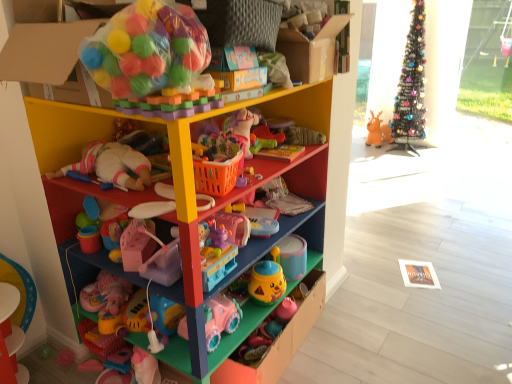
Question: Considering the positions of metallic wire christmas tree at upper right and pink plastic toy at center, the fourth toy from the top, in the image, is metallic wire christmas tree at upper right taller or shorter than pink plastic toy at center, the fourth toy from the top,?

Choices:
 (A) tall
 (B) short

Answer: (A)

Question: From the image's perspective, is metallic wire christmas tree at upper right above or below pink plastic toy at center, placed as the fourth toy when sorted from right to left?

Choices:
 (A) below
 (B) above

Answer: (B)

Question: Estimate the real-world distances between objects in this image. Which object is farther from the metallic wire christmas tree at upper right?

Choices:
 (A) rubber duck at center, the fifth toy in the left-to-right sequence
 (B) transparent glass door at upper right
 (C) matte plastic drawer at center
 (D) translucent plastic ball pit at upper left, which is the first toy from left to right
 (E) pink plastic toy at center, the 3th toy positioned from the bottom

Answer: (D)

Question: Estimate the real-world distances between objects in this image. Which object is closer to the pink plastic toy at center, placed as the fourth toy when sorted from right to left?

Choices:
 (A) orange plastic basket at center
 (B) translucent plastic ball pit at upper left, the fifth toy positioned from the bottom
 (C) pink plastic toy car at lower center, acting as the sixth toy starting from the top
 (D) orange rubber reindeer at center, placed as the 6th toy when sorted from bottom to top
 (E) multicolored plastic shelf at center

Answer: (A)